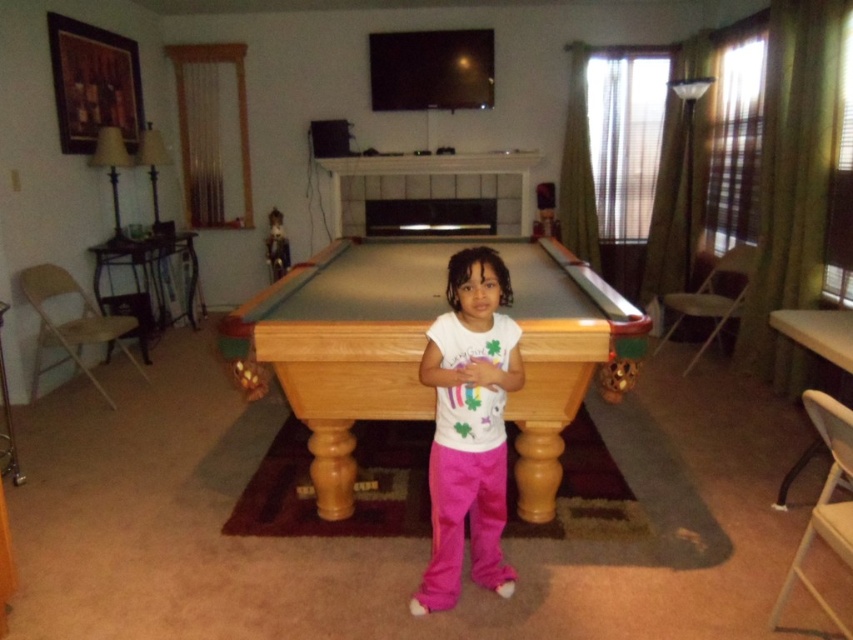
Between light brown wood pool table at center and white cotton shirt at center, which one is positioned lower?

Positioned lower is white cotton shirt at center.

Is light brown wood pool table at center in front of white cotton shirt at center?

No, light brown wood pool table at center is further to the viewer.

Is point (315, 280) positioned after point (461, 374)?

Yes, it is behind point (461, 374).

The width and height of the screenshot is (853, 640). Identify the location of light brown wood pool table at center. (341, 346).